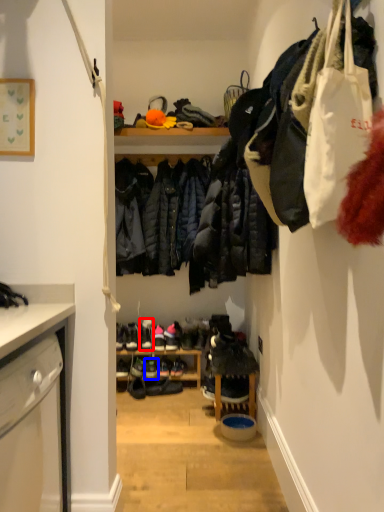
Question: Among these objects, which one is nearest to the camera, footwear (highlighted by a red box) or footwear (highlighted by a blue box)?

Choices:
 (A) footwear
 (B) footwear

Answer: (B)